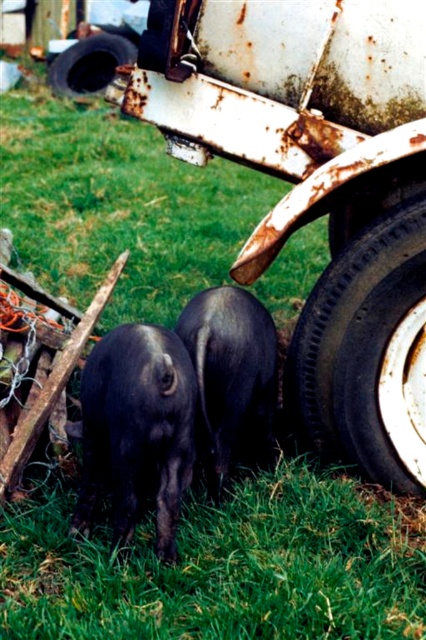
Question: Which is farther from the green grass at lower center?

Choices:
 (A) black rubber tire at lower right
 (B) black matte pig at center
 (C) black rubber tire at lower left
 (D) shiny black pig at center

Answer: (C)

Question: Is green grass at lower center further to camera compared to shiny black pig at center?

Choices:
 (A) yes
 (B) no

Answer: (B)

Question: Among these objects, which one is farthest from the camera?

Choices:
 (A) black rubber tire at lower left
 (B) shiny black pig at center
 (C) black rubber tire at lower right
 (D) green grass at lower center

Answer: (A)

Question: Is green grass at lower center smaller than shiny black pig at center?

Choices:
 (A) yes
 (B) no

Answer: (B)

Question: Based on their relative distances, which object is farther from the black rubber tire at lower right?

Choices:
 (A) shiny black pig at center
 (B) black matte pig at center

Answer: (A)

Question: Observing the image, what is the correct spatial positioning of green grass at lower center in reference to black matte pig at center?

Choices:
 (A) above
 (B) below

Answer: (B)